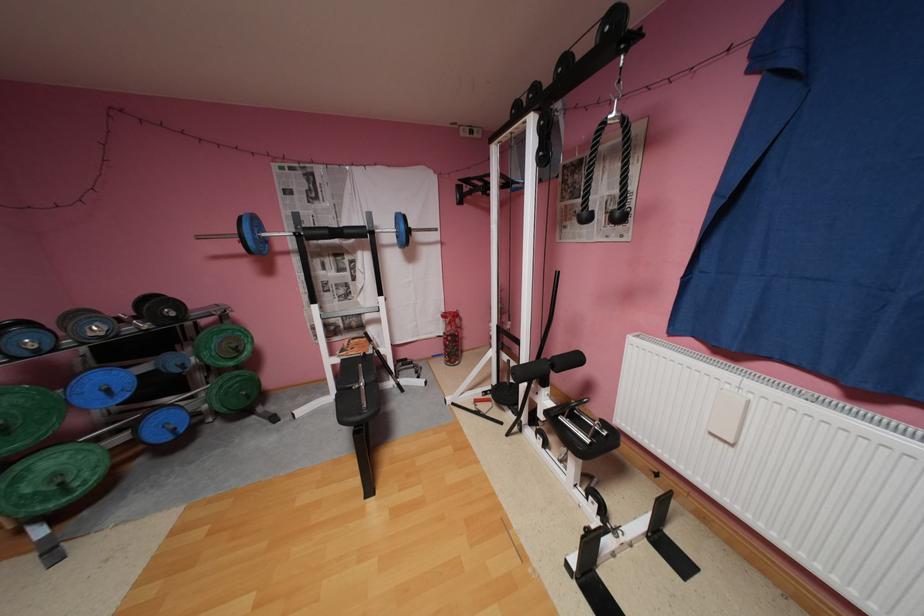
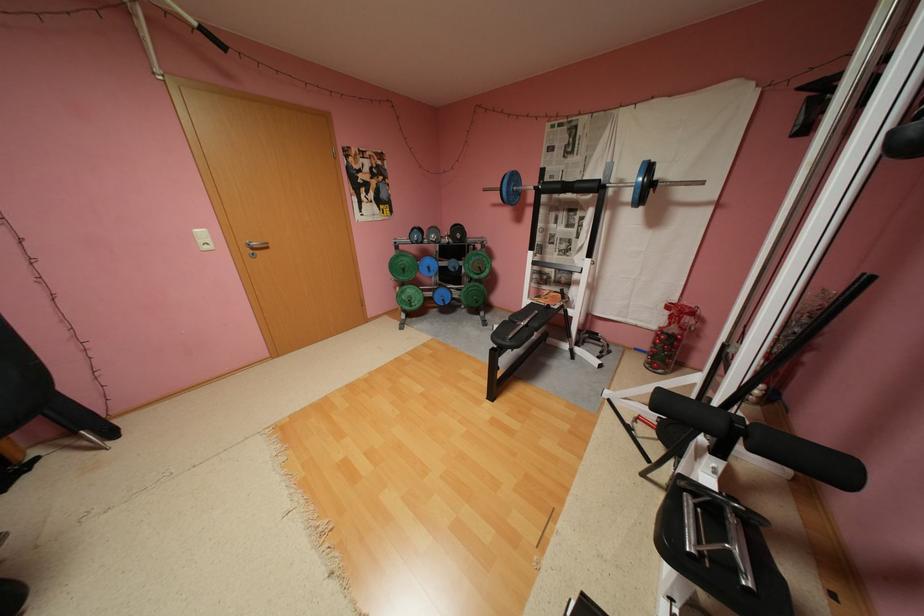
Where in the second image is the point corresponding to (78,492) from the first image?

(419, 306)